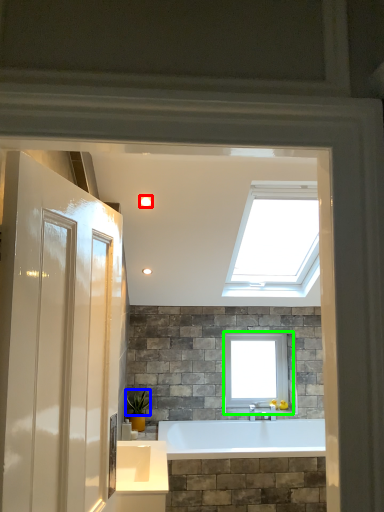
Question: Which object is the farthest from lighting (highlighted by a red box)? Choose among these: plant (highlighted by a blue box) or window (highlighted by a green box).

Choices:
 (A) plant
 (B) window

Answer: (B)